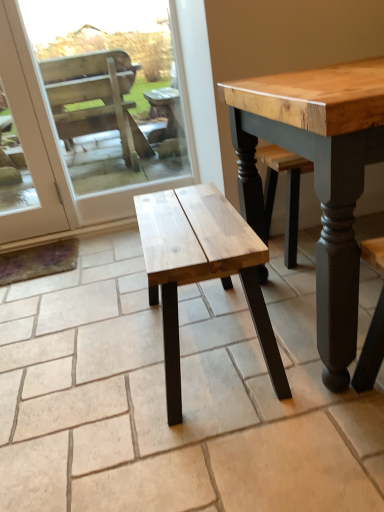
Find the location of a particular element. The height and width of the screenshot is (512, 384). vacant region above natural wood bench at center (from a real-world perspective) is located at coordinates (194, 218).